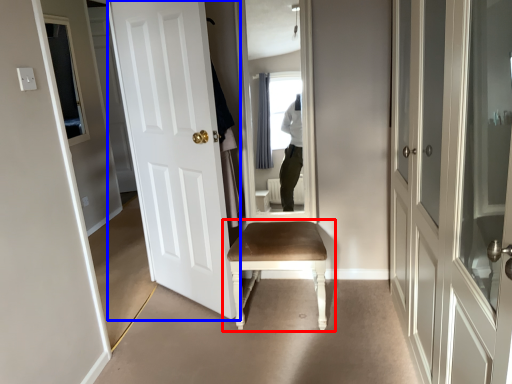
Question: Which point is closer to the camera, chair (highlighted by a red box) or door (highlighted by a blue box)?

Choices:
 (A) chair
 (B) door

Answer: (B)